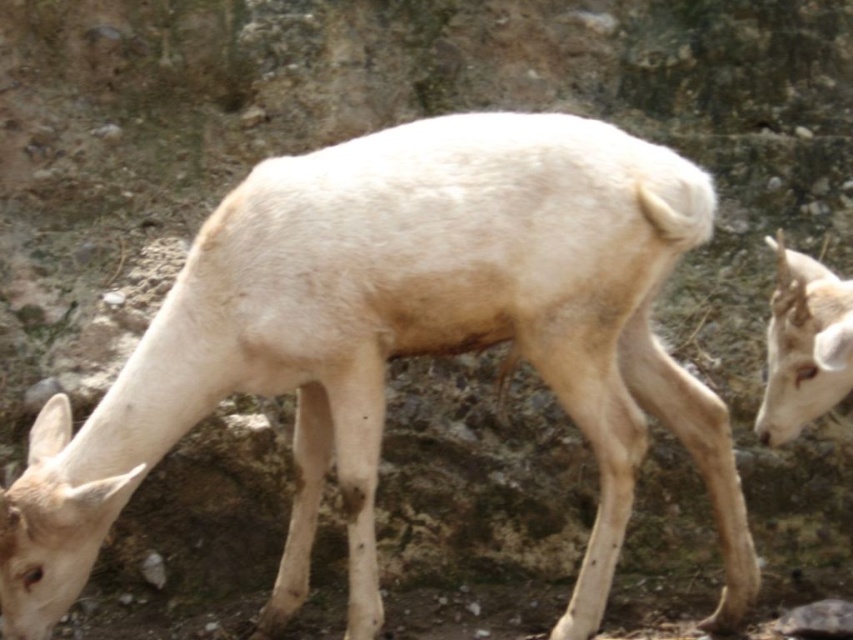
Can you confirm if white woolen deer at center is taller than white matte deer at right?

Indeed, white woolen deer at center has a greater height compared to white matte deer at right.

Looking at this image, which of these two, white woolen deer at center or white matte deer at right, stands taller?

Standing taller between the two is white woolen deer at center.

Between point (509, 310) and point (791, 292), which one is positioned behind?

The point (509, 310) is more distant.

Identify the location of white woolen deer at center. The image size is (853, 640). click(398, 340).